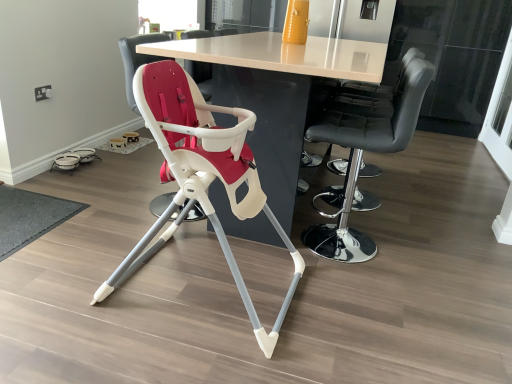
Locate an element on the screen. Image resolution: width=512 pixels, height=384 pixels. vacant space to the right of matte plastic highchair at center, positioned as the 2th chair in right-to-left order is located at coordinates (354, 312).